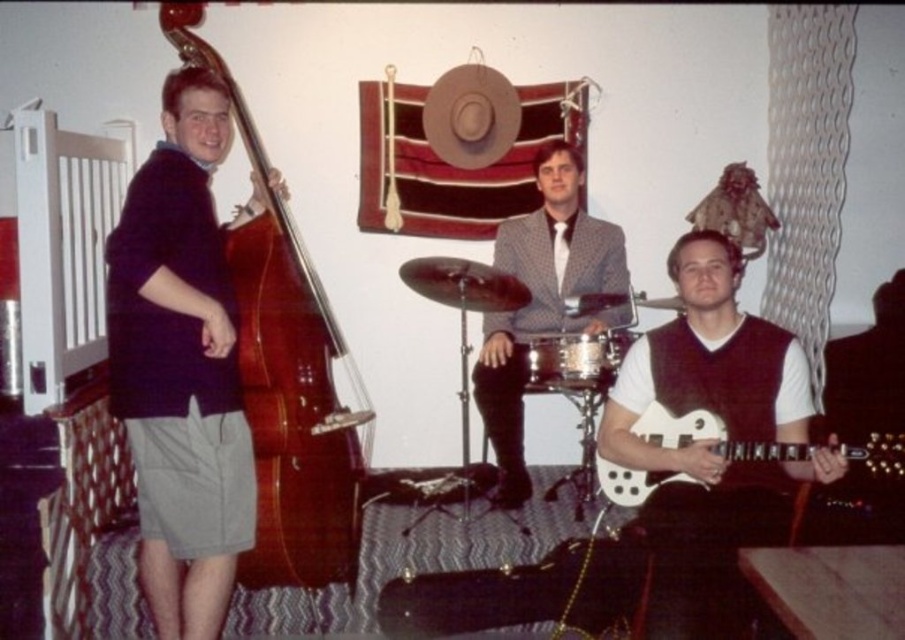
Question: Where is white glossy electric guitar at center located in relation to shiny silver drum at center in the image?

Choices:
 (A) below
 (B) above

Answer: (B)

Question: Among these objects, which one is nearest to the camera?

Choices:
 (A) white glossy electric guitar at center
 (B) matte black shirt at left
 (C) white glossy electric guitar at lower right
 (D) shiny silver drum at center

Answer: (C)

Question: Which is farther from the shiny silver drum at center?

Choices:
 (A) polka dot fabric suit at center
 (B) white glossy electric guitar at center

Answer: (B)

Question: Can you confirm if matte black shirt at left is thinner than shiny silver drum at center?

Choices:
 (A) no
 (B) yes

Answer: (A)

Question: Does white glossy electric guitar at center appear on the left side of shiny silver drum at center?

Choices:
 (A) yes
 (B) no

Answer: (B)

Question: Which point is farther to the camera?

Choices:
 (A) polka dot fabric suit at center
 (B) glossy wood cello at left
 (C) white glossy electric guitar at center

Answer: (A)